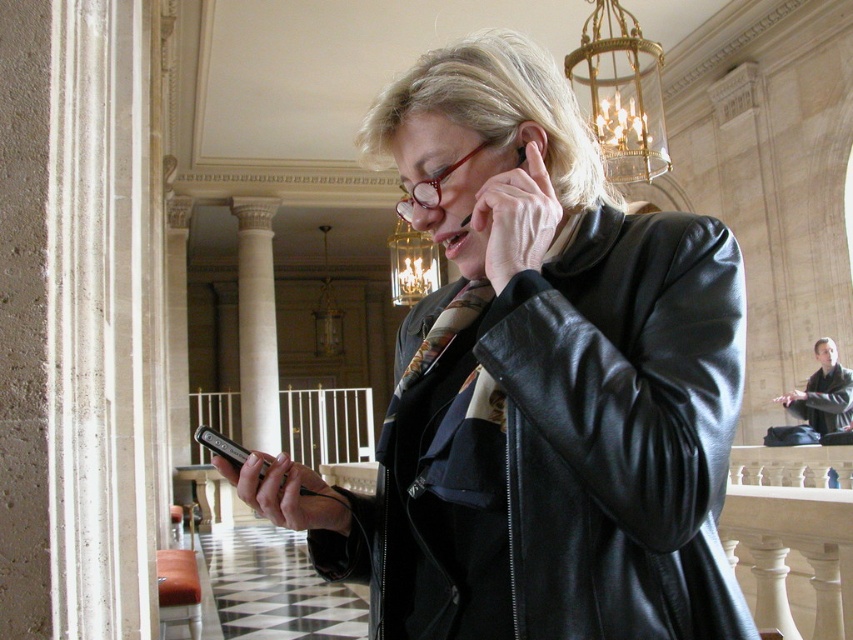
Question: Can you confirm if gold metallic chandelier at upper center is bigger than dark brown leather jacket at right?

Choices:
 (A) no
 (B) yes

Answer: (B)

Question: Which of these objects is positioned closest to the dark brown leather jacket at right?

Choices:
 (A) black leather jacket at center
 (B) multicolored silk tie at center

Answer: (A)

Question: Among these points, which one is nearest to the camera?

Choices:
 (A) (254, 419)
 (B) (461, 324)
 (C) (515, 586)

Answer: (C)

Question: Is gold metallic chandelier at upper center behind multicolored silk tie at center?

Choices:
 (A) no
 (B) yes

Answer: (B)

Question: Considering the relative positions of gold metallic chandelier at upper center and dark brown leather jacket at right in the image provided, where is gold metallic chandelier at upper center located with respect to dark brown leather jacket at right?

Choices:
 (A) left
 (B) right

Answer: (A)

Question: Which point is closer to the camera?

Choices:
 (A) white marble column at center
 (B) black leather jacket at center
 (C) gold metallic chandelier at upper center
 (D) dark brown leather jacket at right

Answer: (B)